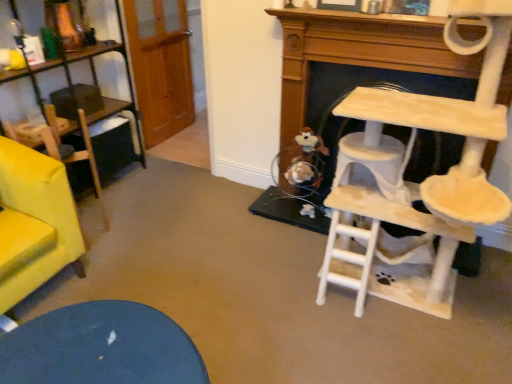
Measure the distance between point (341,197) and camera.

Point (341,197) and camera are 2.10 meters apart.

Where is `beige wooden cat tree at right`? beige wooden cat tree at right is located at coordinates (376, 240).

Which object is further away from the camera taking this photo, beige wooden cat tree at right or velvet yellow armchair at left?

velvet yellow armchair at left is behind.

From the image's perspective, between beige wooden cat tree at right and velvet yellow armchair at left, who is located below?

velvet yellow armchair at left.

Who is taller, beige wooden cat tree at right or velvet yellow armchair at left?

beige wooden cat tree at right is taller.

Can velvet yellow armchair at left be found inside beige wooden cat tree at right?

No, velvet yellow armchair at left is not surrounded by beige wooden cat tree at right.

Are beige felt cat tree at right and beige wooden cat tree at right far apart?

Actually, beige felt cat tree at right and beige wooden cat tree at right are a little close together.

Considering the positions of point (390, 27) and point (394, 222), is point (390, 27) closer or farther from the camera than point (394, 222)?

Point (390, 27) is positioned farther from the camera compared to point (394, 222).

Is beige felt cat tree at right bigger or smaller than beige wooden cat tree at right?

In the image, beige felt cat tree at right appears to be smaller than beige wooden cat tree at right.

From a real-world perspective, is beige felt cat tree at right beneath beige wooden cat tree at right?

Indeed, from a real-world perspective, beige felt cat tree at right is positioned beneath beige wooden cat tree at right.

Does beige felt cat tree at right have a larger size compared to brown plush toy at lower center?

Indeed, beige felt cat tree at right has a larger size compared to brown plush toy at lower center.

Which point is more forward, (409, 41) or (300, 145)?

The point (409, 41) is in front.

Is beige felt cat tree at right outside of brown plush toy at lower center?

Yes.

Which is in front, beige felt cat tree at right or brown plush toy at lower center?

beige felt cat tree at right is closer to the camera.

Looking at their sizes, would you say brown plush toy at lower center is wider or thinner than beige wooden cat tree at right?

Clearly, brown plush toy at lower center has less width compared to beige wooden cat tree at right.

Find the location of a particular element. This screenshot has width=512, height=384. table above the brown plush toy at lower center (from a real-world perspective) is located at coordinates (376, 240).

Is brown plush toy at lower center completely or partially outside of beige wooden cat tree at right?

Indeed, brown plush toy at lower center is completely outside beige wooden cat tree at right.

Is brown plush toy at lower center oriented towards beige wooden cat tree at right?

No, brown plush toy at lower center is not oriented towards beige wooden cat tree at right.

Between velvet yellow armchair at left and beige felt cat tree at right, which one appears on the left side from the viewer's perspective?

velvet yellow armchair at left.

Is velvet yellow armchair at left aimed at beige felt cat tree at right?

No, velvet yellow armchair at left does not turn towards beige felt cat tree at right.

Based on the photo, from a real-world perspective, which is physically above, velvet yellow armchair at left or beige felt cat tree at right?

In real-world perspective, beige felt cat tree at right is above.

Which is closer to the camera, (60, 157) or (302, 16)?

Positioned in front is point (60, 157).

Is velvet yellow armchair at left directly adjacent to beige wooden cat tree at right?

No, velvet yellow armchair at left is not in contact with beige wooden cat tree at right.

Can you confirm if velvet yellow armchair at left is shorter than beige wooden cat tree at right?

Indeed, velvet yellow armchair at left has a lesser height compared to beige wooden cat tree at right.

There is a velvet yellow armchair at left. Where is `table above it (from a real-world perspective)`? The width and height of the screenshot is (512, 384). table above it (from a real-world perspective) is located at coordinates (376, 240).

Which of these two, velvet yellow armchair at left or beige wooden cat tree at right, is thinner?

velvet yellow armchair at left.

Can you tell me how much velvet yellow armchair at left and brown plush toy at lower center differ in facing direction?

The facing directions of velvet yellow armchair at left and brown plush toy at lower center are 95.7 degrees apart.

Considering the sizes of objects velvet yellow armchair at left and brown plush toy at lower center in the image provided, who is shorter, velvet yellow armchair at left or brown plush toy at lower center?

With less height is brown plush toy at lower center.

Is velvet yellow armchair at left far from brown plush toy at lower center?

Yes.

Is velvet yellow armchair at left oriented towards brown plush toy at lower center?

No, velvet yellow armchair at left does not turn towards brown plush toy at lower center.

Locate an element on the screen. The height and width of the screenshot is (384, 512). armchair behind the beige wooden cat tree at right is located at coordinates (72, 151).

Find the location of a particular element. table lying on the left of beige felt cat tree at right is located at coordinates (376, 240).

From the image, which object appears to be farther from beige felt cat tree at right, brown plush toy at lower center or velvet yellow armchair at left?

velvet yellow armchair at left is positioned further to the anchor beige felt cat tree at right.

From the image, which object appears to be farther from beige wooden cat tree at right, velvet yellow armchair at left or beige felt cat tree at right?

velvet yellow armchair at left is further to beige wooden cat tree at right.

Looking at the image, which one is located closer to velvet yellow armchair at left, beige wooden cat tree at right or brown plush toy at lower center?

brown plush toy at lower center lies closer to velvet yellow armchair at left than the other object.

From the image, which object appears to be nearer to brown plush toy at lower center, beige felt cat tree at right or velvet yellow armchair at left?

beige felt cat tree at right lies closer to brown plush toy at lower center than the other object.

Estimate the real-world distances between objects in this image. Which object is closer to beige felt cat tree at right, beige wooden cat tree at right or brown plush toy at lower center?

The object closer to beige felt cat tree at right is brown plush toy at lower center.

Which object lies nearer to the anchor point beige wooden cat tree at right, beige felt cat tree at right or brown plush toy at lower center?

beige felt cat tree at right lies closer to beige wooden cat tree at right than the other object.

Which object lies nearer to the anchor point velvet yellow armchair at left, brown plush toy at lower center or beige wooden cat tree at right?

Among the two, brown plush toy at lower center is located nearer to velvet yellow armchair at left.

Looking at the image, which one is located closer to brown plush toy at lower center, velvet yellow armchair at left or beige felt cat tree at right?

beige felt cat tree at right.

Find the location of a particular element. toy between velvet yellow armchair at left and beige wooden cat tree at right is located at coordinates (307, 160).

You are a GUI agent. You are given a task and a screenshot of the screen. Output one action in this format:
    pyautogui.click(x=<x>, y=<y>)
    Task: Click on the toy situated between velvet yellow armchair at left and beige felt cat tree at right from left to right
    This screenshot has width=512, height=384.
    Given the screenshot: What is the action you would take?
    pyautogui.click(x=307, y=160)

Identify the location of fireplace positioned between beige wooden cat tree at right and brown plush toy at lower center from near to far. Image resolution: width=512 pixels, height=384 pixels. (359, 51).

The height and width of the screenshot is (384, 512). Find the location of `table between velvet yellow armchair at left and beige felt cat tree at right`. table between velvet yellow armchair at left and beige felt cat tree at right is located at coordinates (376, 240).